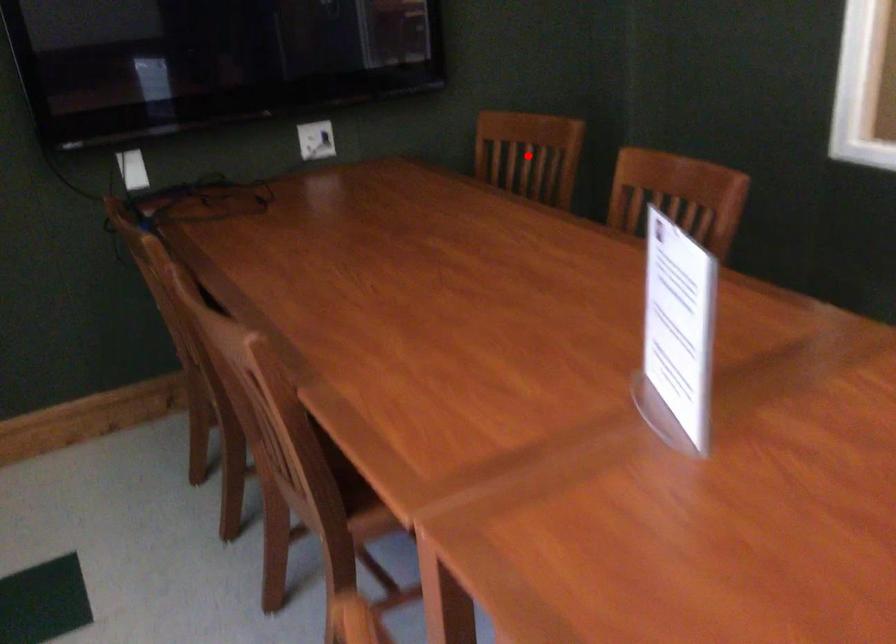
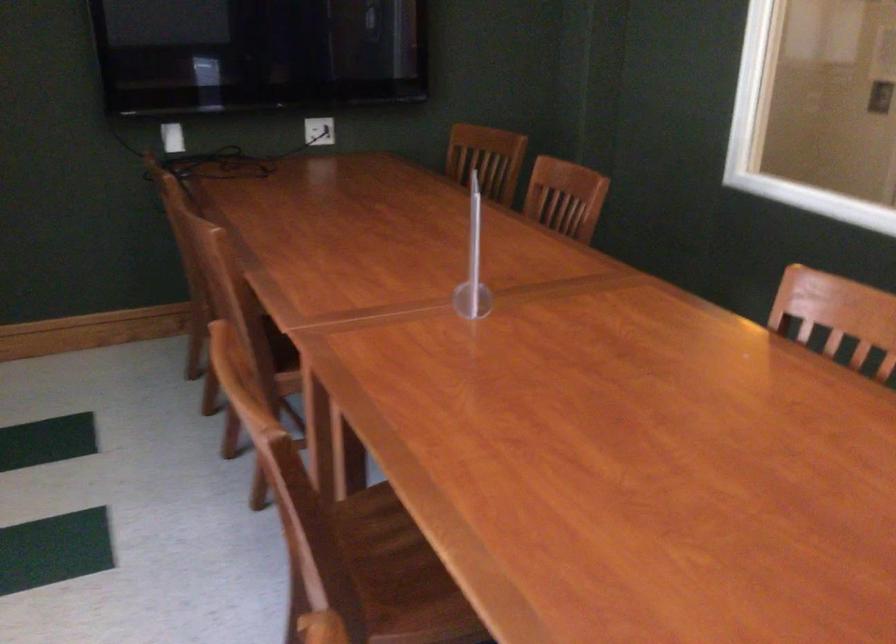
Locate, in the second image, the point that corresponds to the highlighted location in the first image.

(487, 158)